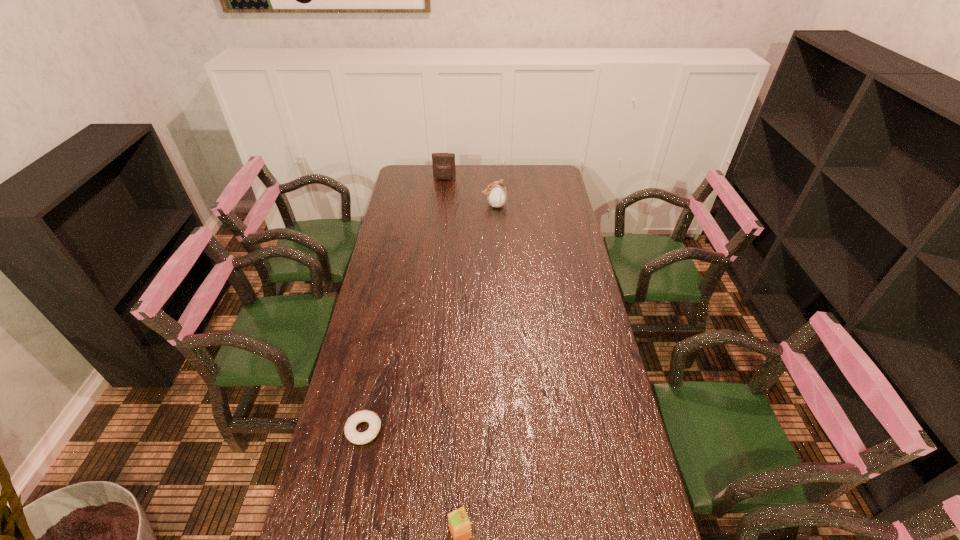
At what (x,y) coordinates should I click in order to perform the action: click on vacant space situated 0.150m on the back of the second nearest object. Please return your answer as a coordinate pair (x, y). This screenshot has width=960, height=540. Looking at the image, I should click on 375,372.

Where is `object that is at the far edge`? Image resolution: width=960 pixels, height=540 pixels. object that is at the far edge is located at coordinates (443, 163).

Identify the location of object that is at the left edge. click(x=351, y=433).

This screenshot has width=960, height=540. Find the location of `blank area at the far edge`. blank area at the far edge is located at coordinates (499, 169).

This screenshot has width=960, height=540. What are the coordinates of `vacant space at the left edge` in the screenshot? It's located at (421, 199).

This screenshot has height=540, width=960. In order to click on free space at the right edge of the desktop in this screenshot , I will do click(x=551, y=204).

I want to click on vacant space at the far left corner of the desktop, so pos(418,176).

You are a GUI agent. You are given a task and a screenshot of the screen. Output one action in this format:
    pyautogui.click(x=<x>, y=<y>)
    Task: Click on the free area in between the second nearest object and the farthest object
    
    Given the screenshot: What is the action you would take?
    pyautogui.click(x=404, y=305)

This screenshot has width=960, height=540. I want to click on vacant area between the farthest object and the leftmost object, so click(404, 305).

Locate an element on the screen. This screenshot has width=960, height=540. free space between the shortest object and the farther pouch is located at coordinates [404, 305].